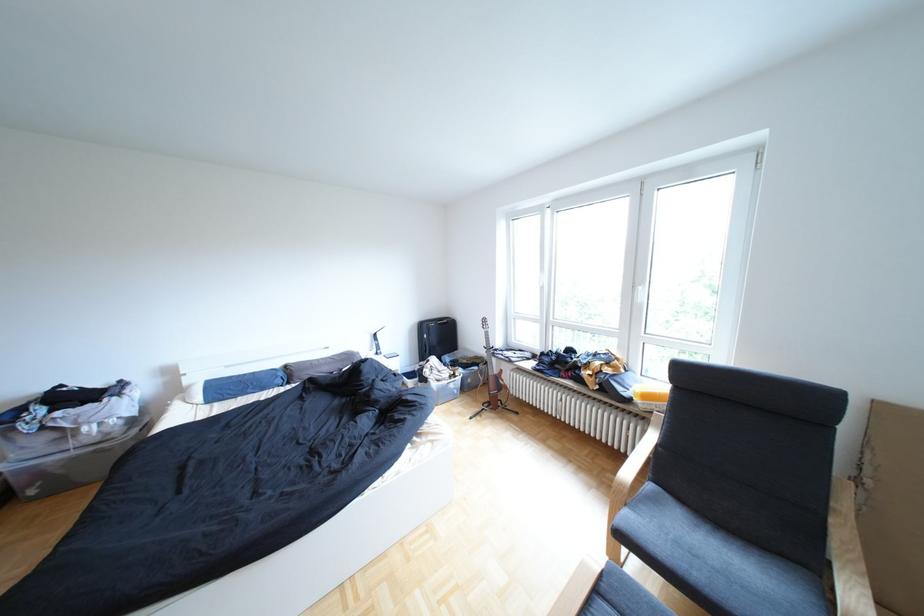
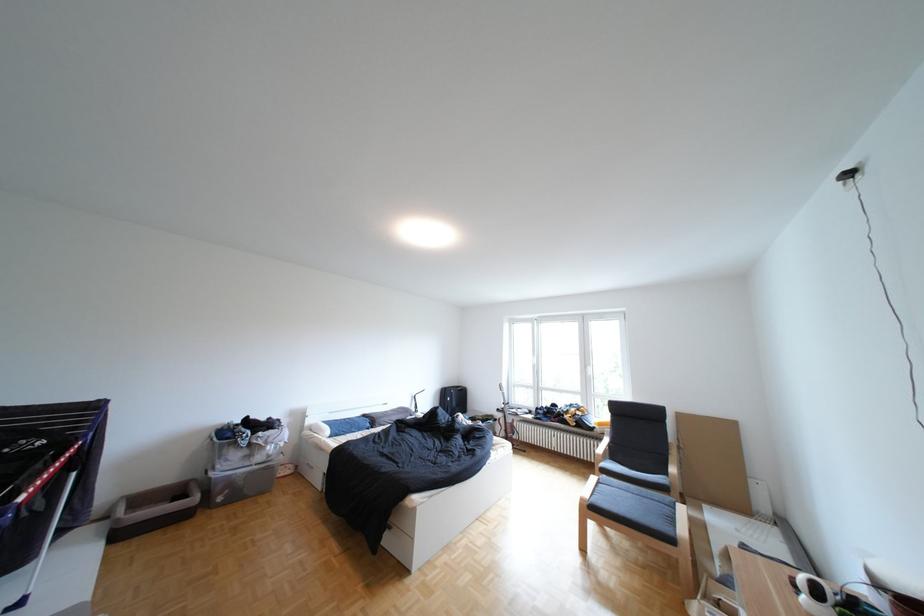
Where in the second image is the point corresponding to pixel 587 468 from the first image?

(584, 474)